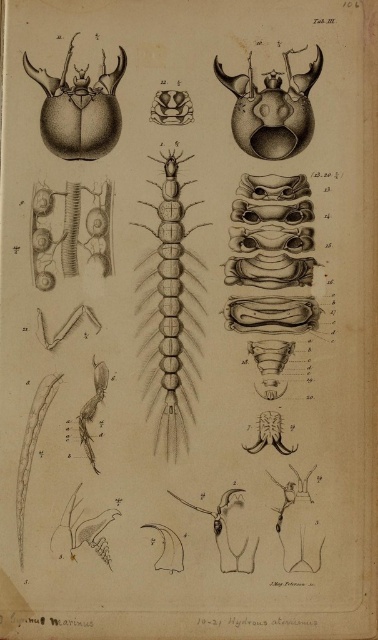
Between matte black beetle at upper left and matte black beetle at upper center, which one is positioned lower?

Positioned lower is matte black beetle at upper center.

This screenshot has height=640, width=378. Describe the element at coordinates (80, 109) in the screenshot. I see `matte black beetle at upper left` at that location.

Locate an element on the screen. matte black beetle at upper left is located at coordinates (80, 109).

Does grayish-brown segmented centipede at center have a greater width compared to matte black beetle at upper left?

No.

Can you confirm if grayish-brown segmented centipede at center is positioned above matte black beetle at upper left?

Actually, grayish-brown segmented centipede at center is below matte black beetle at upper left.

Based on the photo, who is more forward, (165, 180) or (89, 145)?

Positioned in front is point (89, 145).

I want to click on grayish-brown segmented centipede at center, so [170, 308].

Is point (187, 332) less distant than point (297, 84)?

Yes.

Is point (170, 276) closer to camera compared to point (258, 132)?

That is False.

This screenshot has width=378, height=640. I want to click on grayish-brown segmented centipede at center, so click(x=170, y=308).